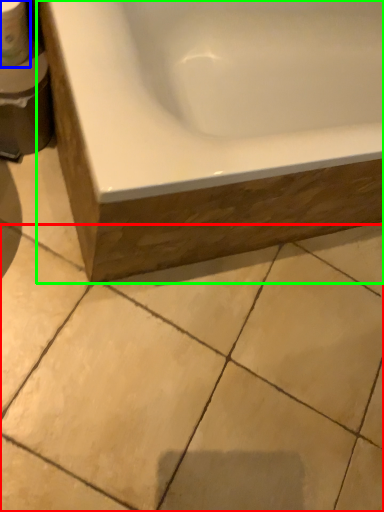
Question: Considering the real-world distances, which object is farthest from ceramic tile (highlighted by a red box)? toilet paper (highlighted by a blue box) or bathtub (highlighted by a green box)?

Choices:
 (A) toilet paper
 (B) bathtub

Answer: (A)